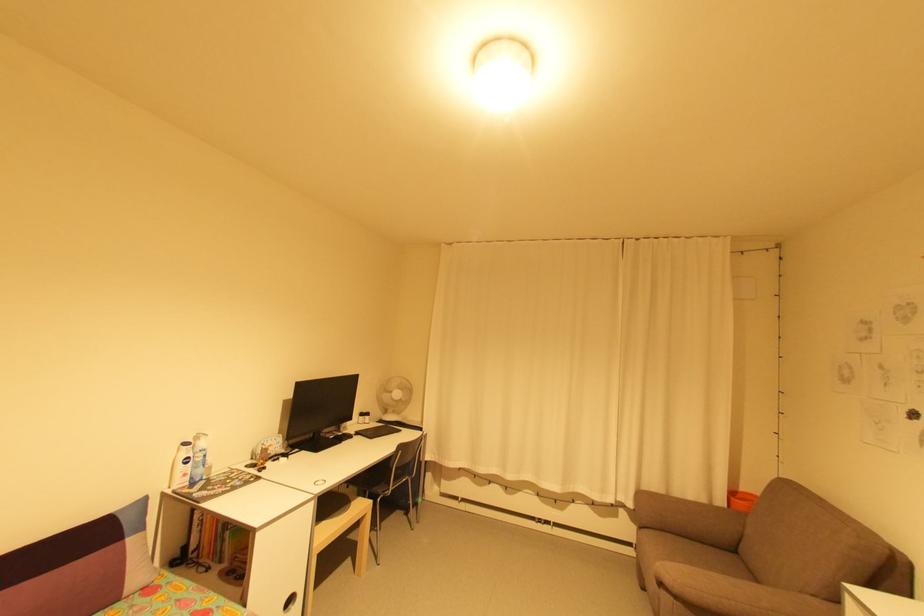
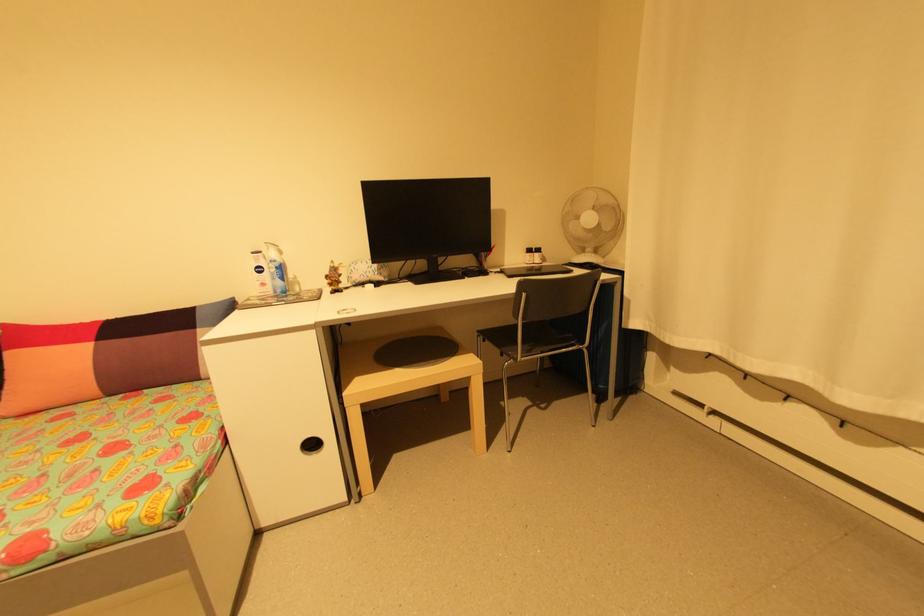
In the second image, find the point that corresponds to point (398, 411) in the first image.

(600, 252)